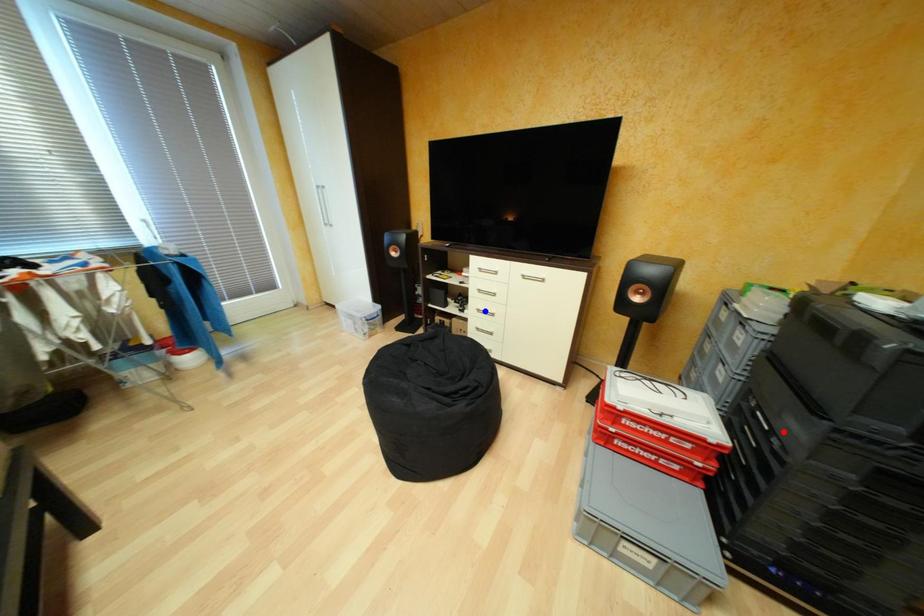
Question: Which of the two points in the image is closer to the camera?

Choices:
 (A) Blue point is closer.
 (B) Red point is closer.

Answer: (B)